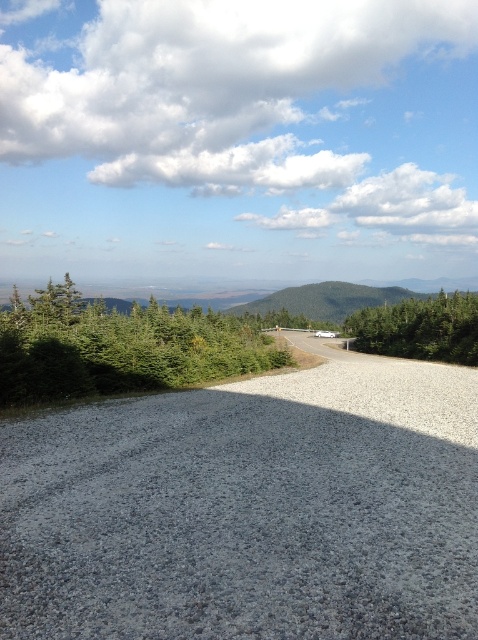
You are a hiker standing on the gravel road and want to take a photo of both the green textured tree at left and the green textured tree at right in the same frame. Which tree should you move closer to in order to include both trees equally in your photo?

You should move closer to the green textured tree at left because it is shorter than the green textured tree at right, allowing both to be framed equally when nearer to the shorter one.

You are standing at the starting point of the road and want to reach the point marked as point (x=454, y=307). There is an obstacle at point (x=98, y=305). Which point is closer to you, the obstacle or the destination?

The obstacle at point (x=98, y=305) is closer to you than the destination point (x=454, y=307).

You are a hiker standing on the gravel road and looking towards the green grassy hill at center. Can you see the top of the green textured tree at left from your current position?

The green textured tree at left is positioned under the green grassy hill at center, so the hill is blocking the view of the tree.